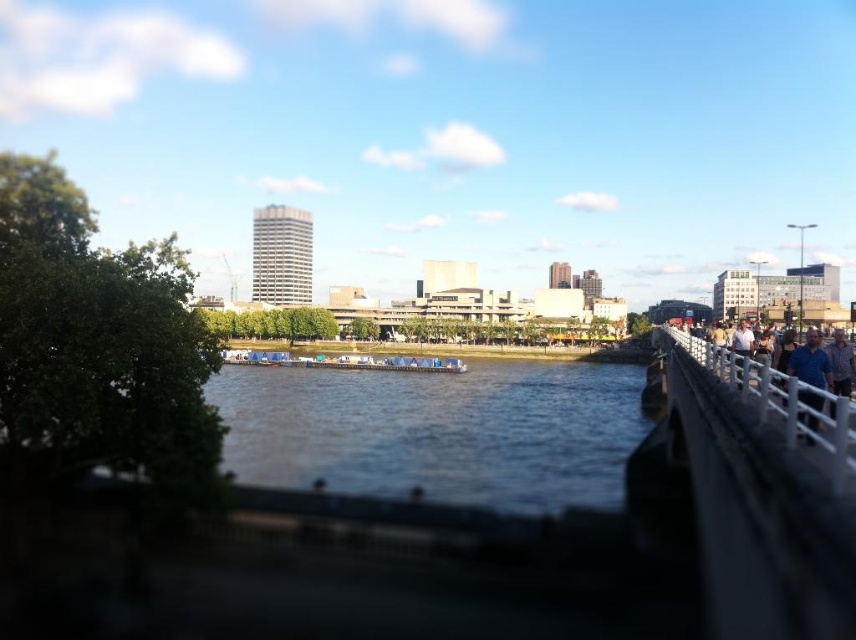
Does point (621, 486) lie in front of point (811, 376)?

No.

Can you confirm if blue water at center is positioned above blue shirt at right?

Incorrect, blue water at center is not positioned above blue shirt at right.

In order to click on blue water at center in this screenshot , I will do `click(437, 429)`.

Is white plastic boat at center shorter than light brown wooden railing at right?

No, white plastic boat at center is not shorter than light brown wooden railing at right.

Which is more to the left, white plastic boat at center or light brown wooden railing at right?

From the viewer's perspective, white plastic boat at center appears more on the left side.

Image resolution: width=856 pixels, height=640 pixels. In order to click on white plastic boat at center in this screenshot , I will do `click(345, 362)`.

The height and width of the screenshot is (640, 856). I want to click on white plastic boat at center, so click(345, 362).

Which is above, blue water at center or white metal railing at right?

Positioned higher is white metal railing at right.

Is blue water at center shorter than white metal railing at right?

Incorrect, blue water at center's height does not fall short of white metal railing at right's.

Describe the element at coordinates (437, 429) in the screenshot. The image size is (856, 640). I see `blue water at center` at that location.

This screenshot has height=640, width=856. I want to click on blue water at center, so click(437, 429).